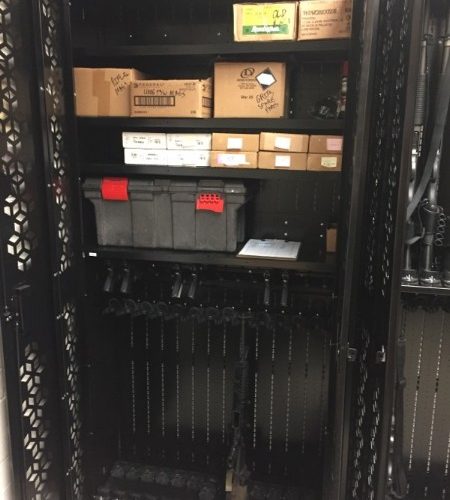
You are a GUI agent. You are given a task and a screenshot of the screen. Output one action in this format:
    pyautogui.click(x=<x>, y=<y>)
    Task: Click on the black shelving unit
    This screenshot has height=500, width=450.
    Given the screenshot: What is the action you would take?
    pyautogui.click(x=361, y=84)